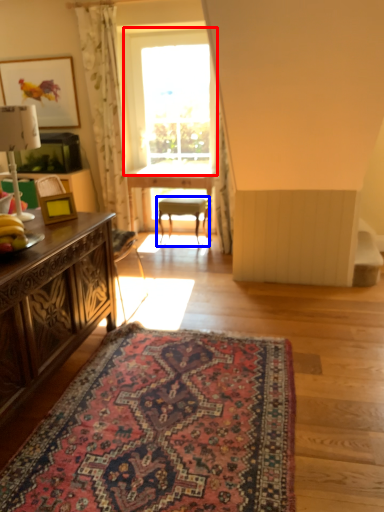
Question: Which of the following is the farthest to the observer, window (highlighted by a red box) or chair (highlighted by a blue box)?

Choices:
 (A) window
 (B) chair

Answer: (B)